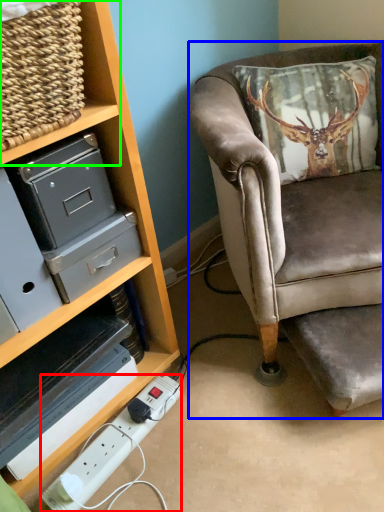
Question: Based on their relative distances, which object is farther from extension cord (highlighted by a red box)? Choose from chair (highlighted by a blue box) and shelf (highlighted by a green box).

Choices:
 (A) chair
 (B) shelf

Answer: (B)